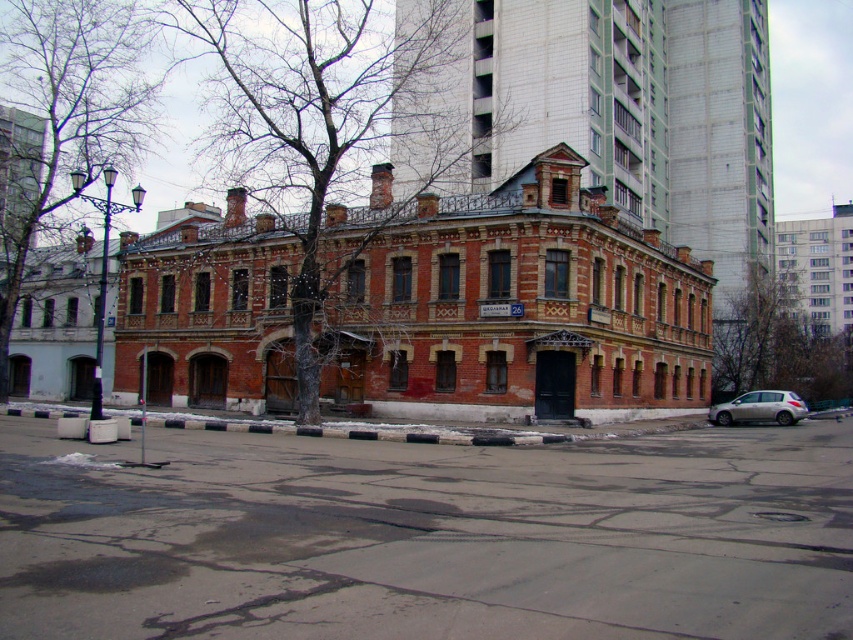
You are a city planner assessing the urban landscape. You need to determine if the bare wood tree at center can provide shade to the silver metallic car at lower right. Based on their sizes and positions, what is your conclusion?

The bare wood tree at center is much taller than the silver metallic car at lower right. However, the tree is positioned at the center of the image, while the car is at the lower right. Without knowing the exact distance between them and the tree canopy spread, it is uncertain if the tree can shade the car. Further measurements are needed.

You are a bird looking for a nesting spot. You see two options in the image, the bare branches at left and the bare branches at right. Which one would you choose if you prefer a higher perch?

The bare branches at left is taller than the bare branches at right, so you should choose the bare branches at left for a higher perch.